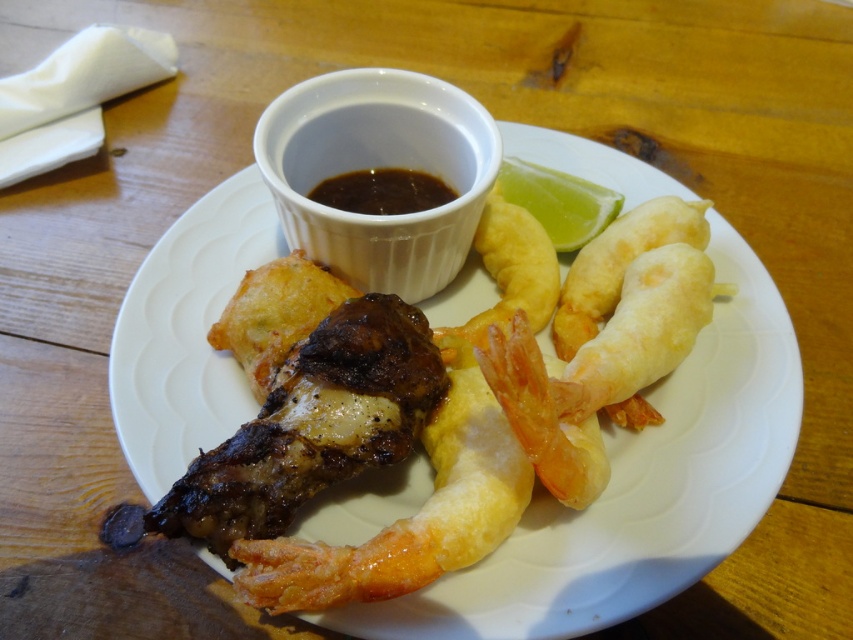
Measure the distance between golden fried shrimp at center and camera.

They are 35.45 inches apart.

Between golden fried shrimp at center and dark glossy sauce at center, which one is positioned higher?

dark glossy sauce at center is higher up.

Who is more forward, [494,269] or [376,168]?

Point [494,269] is more forward.

The image size is (853, 640). Find the location of `golden fried shrimp at center`. golden fried shrimp at center is located at coordinates (503, 419).